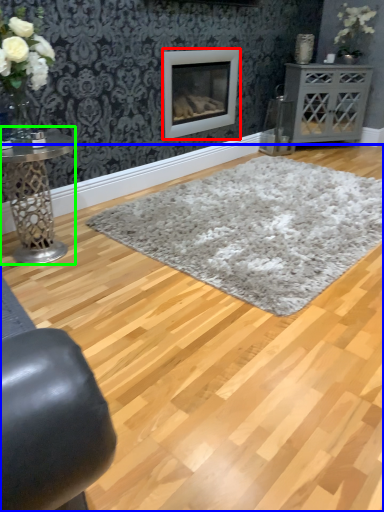
Question: Which object is positioned closest to wood burning stove (highlighted by a red box)? Select from plain (highlighted by a blue box) and table (highlighted by a green box).

Choices:
 (A) plain
 (B) table

Answer: (B)